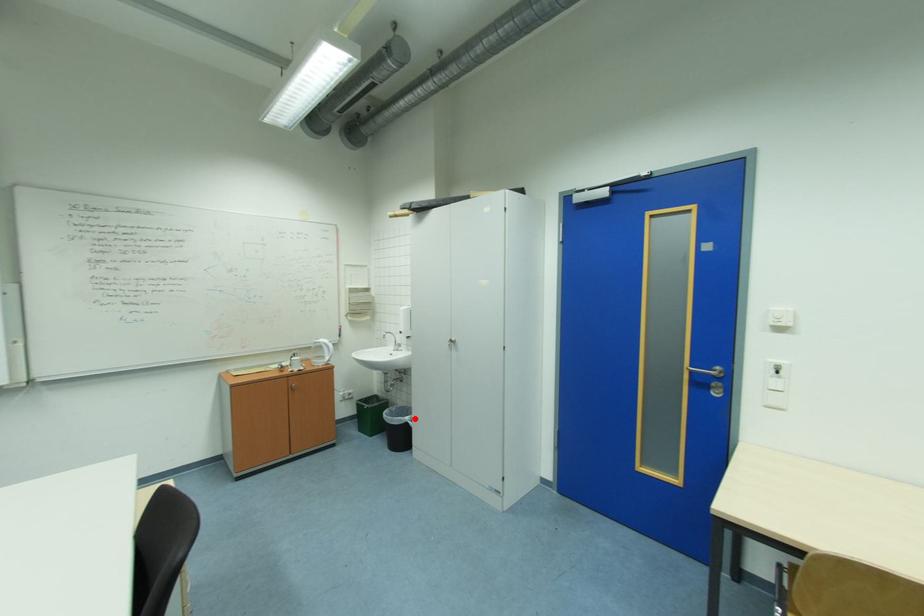
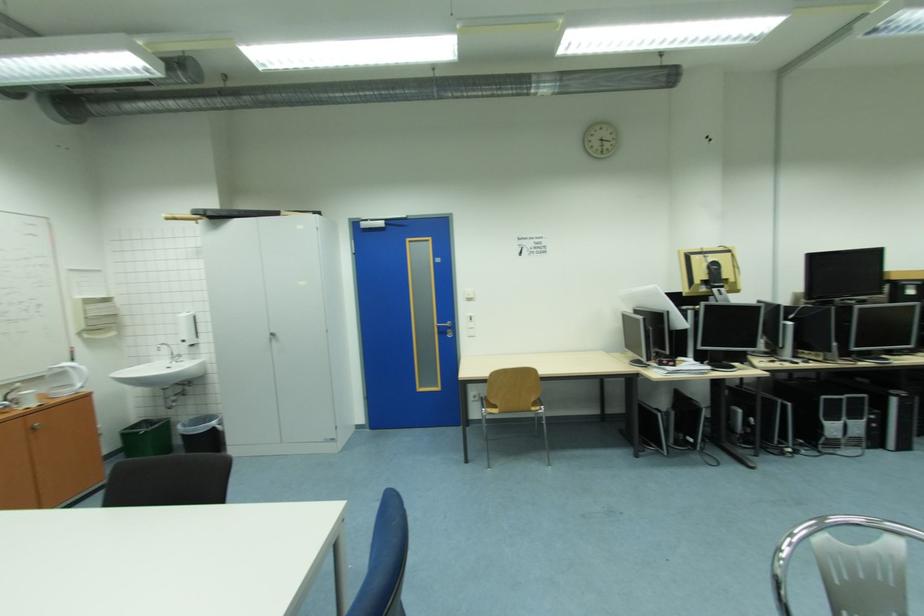
Find the pixel in the second image that matches the highlighted location in the first image.

(220, 424)